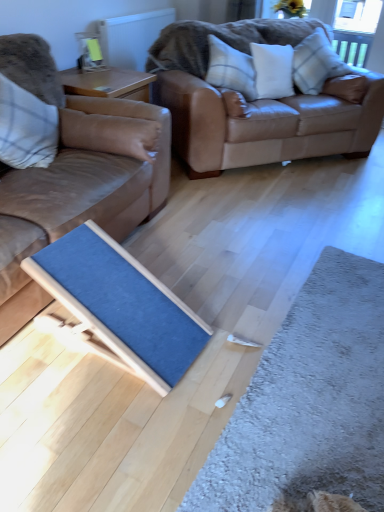
Locate an element on the screen. This screenshot has width=384, height=512. free region on the left part of blue fabric doormat at lower right, which ranks as the second doormat in left-to-right order is located at coordinates (148, 392).